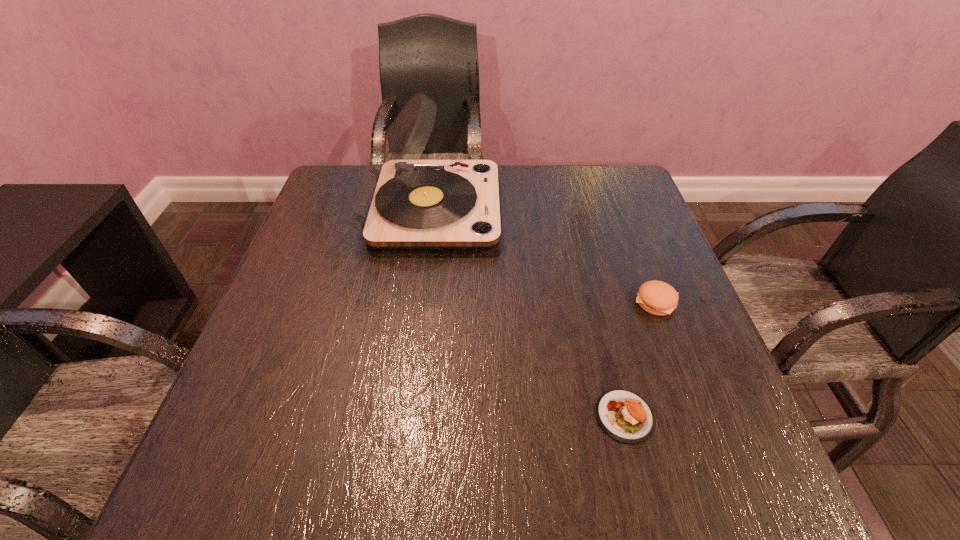
You are a GUI agent. You are given a task and a screenshot of the screen. Output one action in this format:
    pyautogui.click(x=<x>, y=<y>)
    Task: Click on the object situated at the left edge
    The width and height of the screenshot is (960, 540).
    Given the screenshot: What is the action you would take?
    pyautogui.click(x=402, y=202)

Find the location of a particular element. The image size is (960, 540). object present at the far left corner is located at coordinates (402, 202).

The image size is (960, 540). I want to click on free space at the far edge of the desktop, so click(533, 174).

Identify the location of vacant space at the near edge of the desktop. (406, 480).

Find the location of a particular element. The width and height of the screenshot is (960, 540). free space at the left edge is located at coordinates (330, 267).

Image resolution: width=960 pixels, height=540 pixels. What are the coordinates of `blank space at the right edge of the desktop` in the screenshot? It's located at (650, 226).

In the image, there is a desktop. What are the coordinates of `free space at the far left corner` in the screenshot? It's located at (333, 176).

In the image, there is a desktop. In order to click on vacant space at the far right corner in this screenshot , I will do `click(609, 210)`.

The width and height of the screenshot is (960, 540). What are the coordinates of `vacant point located between the shortest object and the tallest object` in the screenshot? It's located at (528, 313).

You are a GUI agent. You are given a task and a screenshot of the screen. Output one action in this format:
    pyautogui.click(x=<x>, y=<y>)
    Task: Click on the free spot between the rightmost object and the second object from left to right
    This screenshot has height=540, width=960.
    Given the screenshot: What is the action you would take?
    pyautogui.click(x=640, y=359)